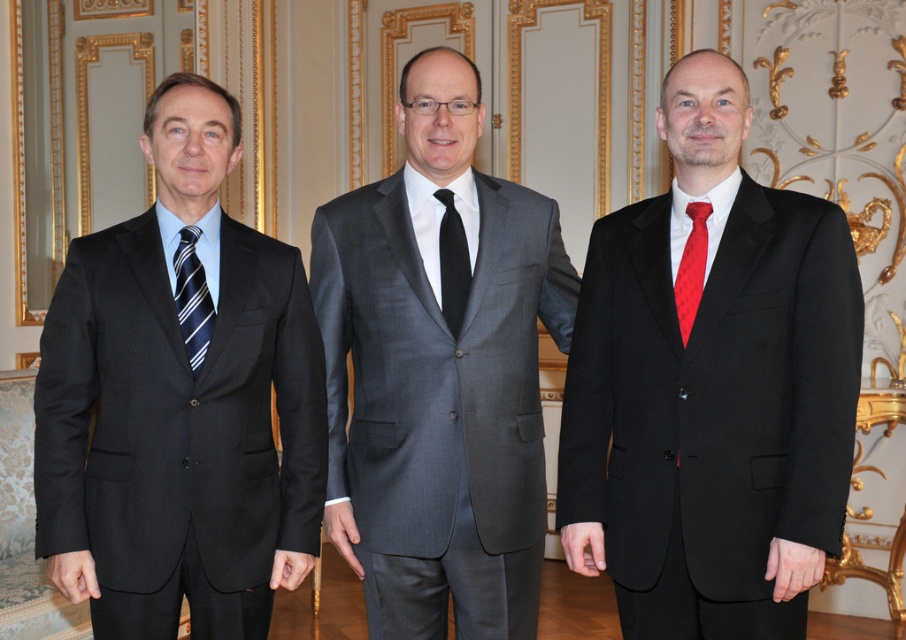
Can you confirm if matte black suit at right is positioned above striped fabric tie at left?

Incorrect, matte black suit at right is not positioned above striped fabric tie at left.

Can you confirm if matte black suit at right is thinner than striped fabric tie at left?

In fact, matte black suit at right might be wider than striped fabric tie at left.

This screenshot has height=640, width=906. In order to click on matte black suit at right in this screenshot , I will do `click(711, 388)`.

Find the location of a particular element. The image size is (906, 640). matte black suit at right is located at coordinates (711, 388).

Between matte black suit at left and striped fabric tie at left, which one has more height?

Standing taller between the two is matte black suit at left.

Does matte black suit at left appear on the left side of striped fabric tie at left?

Indeed, matte black suit at left is positioned on the left side of striped fabric tie at left.

Find the location of a particular element. matte black suit at left is located at coordinates (179, 403).

Is matte black suit at left above black silk tie at center?

Incorrect, matte black suit at left is not positioned above black silk tie at center.

Is matte black suit at left shorter than black silk tie at center?

In fact, matte black suit at left may be taller than black silk tie at center.

The height and width of the screenshot is (640, 906). What are the coordinates of `matte black suit at left` in the screenshot? It's located at (179, 403).

This screenshot has width=906, height=640. I want to click on matte black suit at left, so click(x=179, y=403).